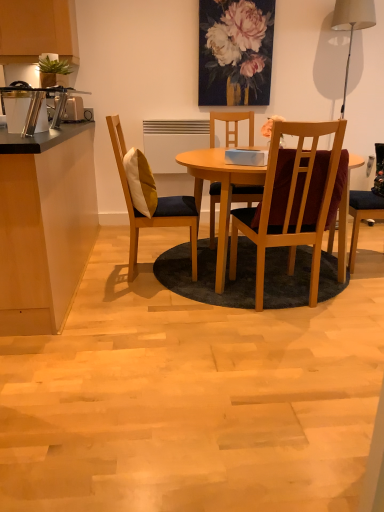
Question: Is white fabric lampshade at upper right in front of or behind matte floral painting at upper center in the image?

Choices:
 (A) behind
 (B) front

Answer: (B)

Question: Considering the positions of white fabric lampshade at upper right and matte floral painting at upper center in the image, is white fabric lampshade at upper right bigger or smaller than matte floral painting at upper center?

Choices:
 (A) small
 (B) big

Answer: (B)

Question: Which is nearer to the black laminate countertop at left?

Choices:
 (A) wooden chair at center, arranged as the 1th chair when viewed from the right
 (B) wooden table at center
 (C) wooden chair with cushion at left, the first chair in the left-to-right sequence
 (D) silver metallic toaster at left
 (E) matte wood cabinet at upper left

Answer: (C)

Question: Which object is positioned farthest from the black laminate countertop at left?

Choices:
 (A) matte wood cabinet at upper left
 (B) silver metallic toaster at left
 (C) wooden table at center
 (D) white fabric lampshade at upper right
 (E) wooden chair with cushion at left, acting as the 2th chair starting from the right

Answer: (D)